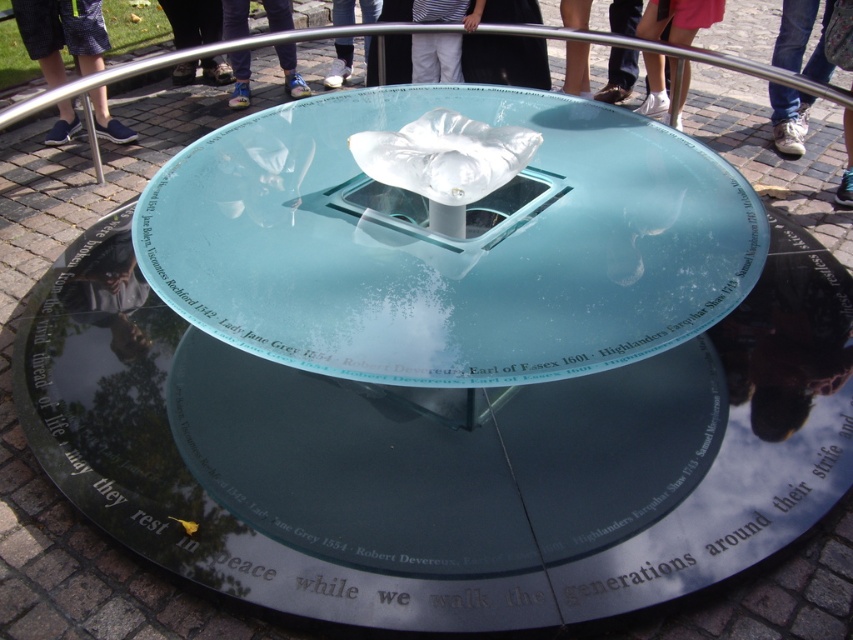
Is pink fabric skirt at upper center positioned at the back of dark blue jeans at center?

No, it is not.

Can you confirm if pink fabric skirt at upper center is smaller than dark blue jeans at center?

No.

Where is `pink fabric skirt at upper center`? This screenshot has height=640, width=853. pink fabric skirt at upper center is located at coordinates (677, 19).

Locate an element on the screen. Image resolution: width=853 pixels, height=640 pixels. white cotton pants at center is located at coordinates [x=436, y=58].

Between white cotton pants at center and blue fabric pants at center, which one is positioned lower?

white cotton pants at center is lower down.

Between point (434, 80) and point (294, 54), which one is positioned behind?

The point (294, 54) is more distant.

This screenshot has width=853, height=640. What are the coordinates of `white cotton pants at center` in the screenshot? It's located at (436, 58).

Does blue denim shorts at left have a larger size compared to blue fabric pants at center?

Correct, blue denim shorts at left is larger in size than blue fabric pants at center.

Does blue denim shorts at left have a lesser height compared to blue fabric pants at center?

Correct, blue denim shorts at left is not as tall as blue fabric pants at center.

Does point (36, 38) lie behind point (300, 83)?

No, (36, 38) is closer to viewer.

Locate an element on the screen. The width and height of the screenshot is (853, 640). blue denim shorts at left is located at coordinates (62, 35).